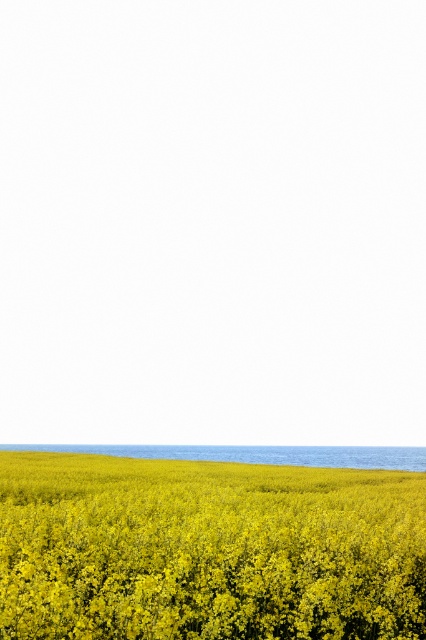
Which is in front, point (284, 545) or point (253, 456)?

Point (284, 545) is in front.

Which is more to the left, yellow matte flower at bottom or blue smooth water at bottom?

From the viewer's perspective, blue smooth water at bottom appears more on the left side.

Between point (226, 614) and point (299, 461), which one is positioned in front?

Point (226, 614) is more forward.

Identify the location of yellow matte flower at bottom. (207, 550).